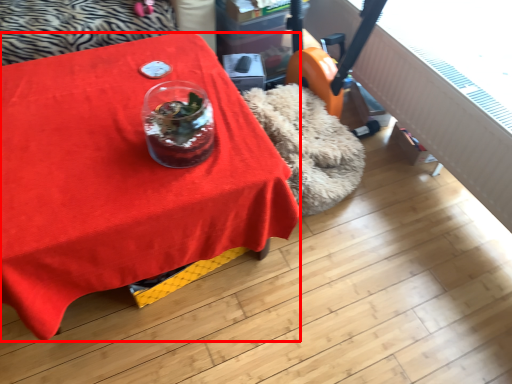
Question: From the image's perspective, what is the correct spatial positioning of table (annotated by the red box) in reference to glass vase?

Choices:
 (A) above
 (B) below

Answer: (B)